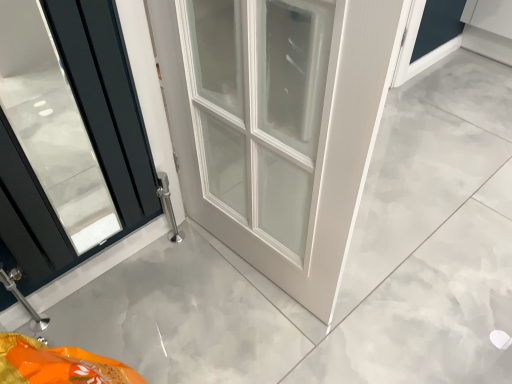
In order to face white glossy door at center, should I rotate leftwards or rightwards?

To align with it, rotate left about 13.016°.

Identify the location of white glossy door at center. (277, 125).

What do you see at coordinates (277, 125) in the screenshot? I see `white glossy door at center` at bounding box center [277, 125].

Locate an element on the screen. white glossy door at center is located at coordinates (277, 125).